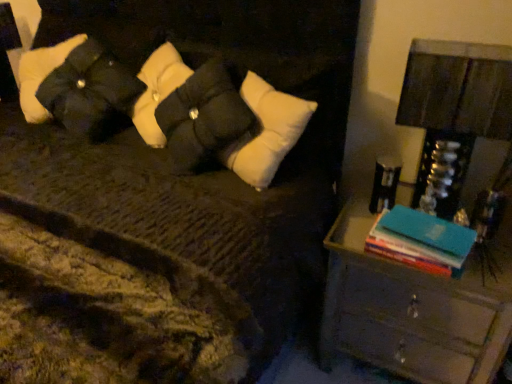
Question: From the image's perspective, is metallic silver lampshade at right located beneath wooden nightstand at right?

Choices:
 (A) yes
 (B) no

Answer: (B)

Question: From the image's perspective, is metallic silver lampshade at right on wooden nightstand at right?

Choices:
 (A) yes
 (B) no

Answer: (A)

Question: Does metallic silver lampshade at right have a smaller size compared to wooden nightstand at right?

Choices:
 (A) yes
 (B) no

Answer: (A)

Question: Is metallic silver lampshade at right turned away from wooden nightstand at right?

Choices:
 (A) yes
 (B) no

Answer: (B)

Question: Can you confirm if metallic silver lampshade at right is bigger than wooden nightstand at right?

Choices:
 (A) yes
 (B) no

Answer: (B)

Question: From their relative heights in the image, would you say black quilted pillow at upper left is taller or shorter than metallic silver lampshade at right?

Choices:
 (A) tall
 (B) short

Answer: (B)

Question: Is black quilted pillow at upper left to the left or to the right of metallic silver lampshade at right in the image?

Choices:
 (A) left
 (B) right

Answer: (A)

Question: Is black quilted pillow at upper left inside the boundaries of metallic silver lampshade at right, or outside?

Choices:
 (A) inside
 (B) outside

Answer: (B)

Question: From the image's perspective, is black quilted pillow at upper left positioned above or below metallic silver lampshade at right?

Choices:
 (A) above
 (B) below

Answer: (A)

Question: In terms of height, does blue hardcover book at right look taller or shorter compared to black quilted pillow at upper left?

Choices:
 (A) short
 (B) tall

Answer: (A)

Question: Would you say blue hardcover book at right is inside or outside black quilted pillow at upper left?

Choices:
 (A) inside
 (B) outside

Answer: (B)

Question: Is point (450, 251) positioned closer to the camera than point (101, 64)?

Choices:
 (A) closer
 (B) farther

Answer: (A)

Question: From the image's perspective, is blue hardcover book at right located above or below black quilted pillow at upper left?

Choices:
 (A) above
 (B) below

Answer: (B)

Question: Is wooden nightstand at right wider or thinner than blue hardcover book at right?

Choices:
 (A) thin
 (B) wide

Answer: (B)

Question: Is point (429, 109) closer or farther from the camera than point (461, 226)?

Choices:
 (A) closer
 (B) farther

Answer: (A)